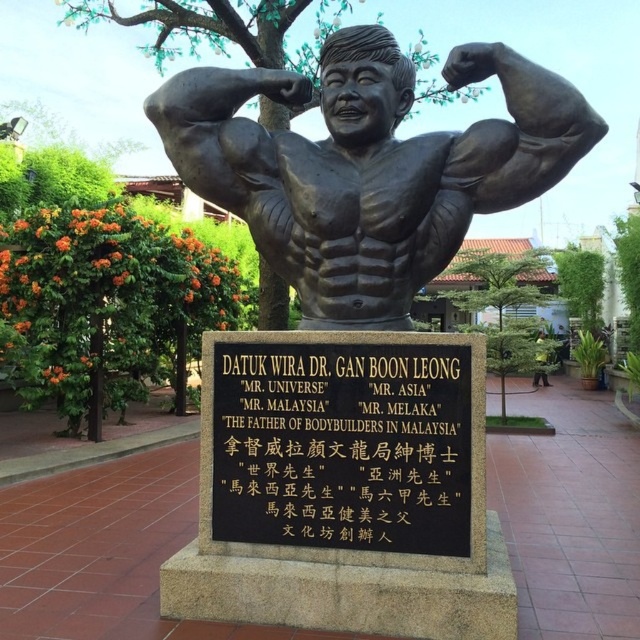
Measure the distance from bronze statue at center to bronze/statue at center.

bronze statue at center and bronze/statue at center are 8.02 inches apart from each other.

In the scene shown: Does bronze statue at center have a greater height compared to bronze/statue at center?

Yes, bronze statue at center is taller than bronze/statue at center.

Does point (314, 188) come closer to viewer compared to point (285, 220)?

Yes.

Where is `bronze statue at center`? This screenshot has height=640, width=640. bronze statue at center is located at coordinates (355, 349).

This screenshot has height=640, width=640. I want to click on bronze statue at center, so (355, 349).

Is bronze statue at center smaller than black metal plaque at center?

Actually, bronze statue at center might be larger than black metal plaque at center.

Between point (356, 68) and point (276, 346), which one is positioned behind?

The point (356, 68) is behind.

Find the location of a particular element. bronze statue at center is located at coordinates (x=355, y=349).

Does bronze/statue at center have a lesser height compared to black metal plaque at center?

In fact, bronze/statue at center may be taller than black metal plaque at center.

Does bronze/statue at center come behind black metal plaque at center?

Yes, bronze/statue at center is behind black metal plaque at center.

Is point (280, 209) in front of point (294, 371)?

No, (280, 209) is further to viewer.

At what (x,y) coordinates should I click in order to perform the action: click on bronze/statue at center. Please return your answer as a coordinate pair (x, y). Looking at the image, I should click on (369, 166).